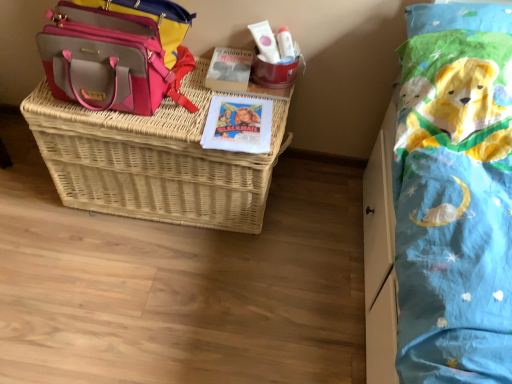
Question: Does white matte tube at upper center contain woven wicker basket at center?

Choices:
 (A) yes
 (B) no

Answer: (B)

Question: Considering the relative positions of white matte tube at upper center and woven wicker basket at center in the image provided, is white matte tube at upper center to the left of woven wicker basket at center from the viewer's perspective?

Choices:
 (A) no
 (B) yes

Answer: (A)

Question: Is white matte tube at upper center completely or partially outside of woven wicker basket at center?

Choices:
 (A) no
 (B) yes

Answer: (B)

Question: Considering the relative sizes of white matte tube at upper center and woven wicker basket at center in the image provided, is white matte tube at upper center bigger than woven wicker basket at center?

Choices:
 (A) yes
 (B) no

Answer: (B)

Question: From the image's perspective, is white matte tube at upper center on top of woven wicker basket at center?

Choices:
 (A) yes
 (B) no

Answer: (A)

Question: In terms of height, does pink leather shoulder bag at upper left look taller or shorter compared to white matte tube at upper center?

Choices:
 (A) short
 (B) tall

Answer: (B)

Question: Would you say pink leather shoulder bag at upper left is inside or outside white matte tube at upper center?

Choices:
 (A) outside
 (B) inside

Answer: (A)

Question: From the image's perspective, is pink leather shoulder bag at upper left above or below white matte tube at upper center?

Choices:
 (A) above
 (B) below

Answer: (A)

Question: From a real-world perspective, is pink leather shoulder bag at upper left physically located above or below white matte tube at upper center?

Choices:
 (A) above
 (B) below

Answer: (A)

Question: From a real-world perspective, is white matte tube at upper center positioned above or below pink leather shoulder bag at upper left?

Choices:
 (A) above
 (B) below

Answer: (B)

Question: Is point (270, 56) closer or farther from the camera than point (135, 77)?

Choices:
 (A) farther
 (B) closer

Answer: (A)

Question: Looking at the image, does white matte tube at upper center seem bigger or smaller compared to pink leather shoulder bag at upper left?

Choices:
 (A) small
 (B) big

Answer: (A)

Question: Considering the positions of white matte tube at upper center and pink leather shoulder bag at upper left in the image, is white matte tube at upper center taller or shorter than pink leather shoulder bag at upper left?

Choices:
 (A) tall
 (B) short

Answer: (B)

Question: Looking at the image, does woven wicker basket at center seem bigger or smaller compared to white matte tube at upper center?

Choices:
 (A) big
 (B) small

Answer: (A)

Question: From a real-world perspective, is woven wicker basket at center physically located above or below white matte tube at upper center?

Choices:
 (A) above
 (B) below

Answer: (B)